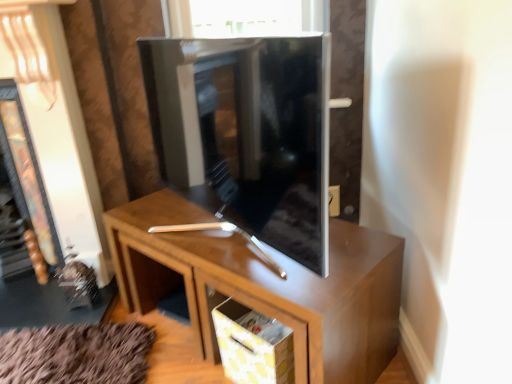
Question: Is brown wood cabinet at center in front of or behind yellow dotted fabric drawer at lower center in the image?

Choices:
 (A) front
 (B) behind

Answer: (A)

Question: Choose the correct answer: Is brown wood cabinet at center inside yellow dotted fabric drawer at lower center or outside it?

Choices:
 (A) outside
 (B) inside

Answer: (A)

Question: Considering the real-world distances, which object is farthest from the brown wood cabinet at center?

Choices:
 (A) yellow dotted fabric drawer at lower center
 (B) matte black fireplace at left
 (C) glossy wood tv cabinet at center

Answer: (B)

Question: Based on their relative distances, which object is farther from the glossy wood tv cabinet at center?

Choices:
 (A) yellow dotted fabric drawer at lower center
 (B) matte black fireplace at left
 (C) brown wood cabinet at center

Answer: (B)